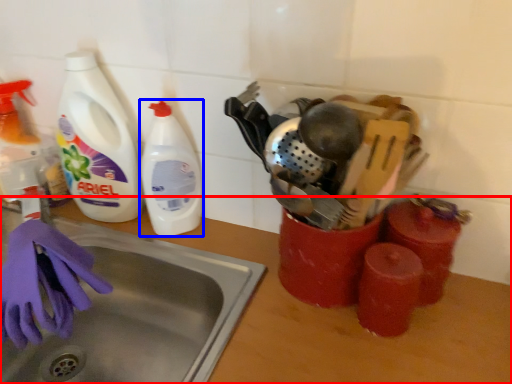
Question: Which of the following is the farthest to the observer, counter top (highlighted by a red box) or cleaning product (highlighted by a blue box)?

Choices:
 (A) counter top
 (B) cleaning product

Answer: (B)